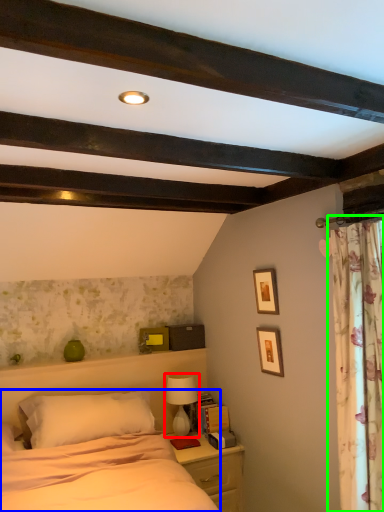
Question: Based on their relative distances, which object is nearer to table lamp (highlighted by a red box)? Choose from bed (highlighted by a blue box) and curtain (highlighted by a green box).

Choices:
 (A) bed
 (B) curtain

Answer: (A)